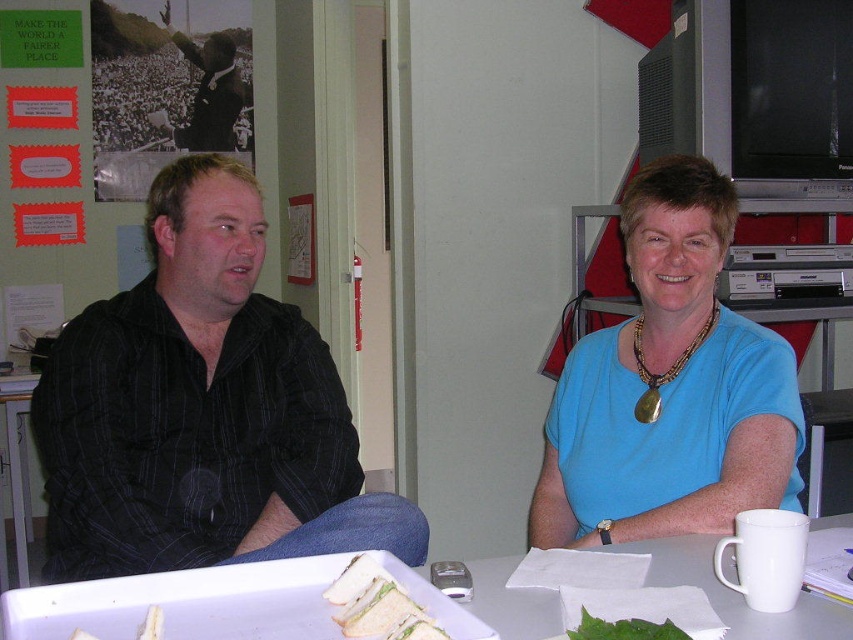
Question: Estimate the real-world distances between objects in this image. Which object is closer to the white bread sandwich at lower center?

Choices:
 (A) green leafy vegetable at lower center
 (B) black suit jacket at upper left
 (C) black striped shirt at left

Answer: (A)

Question: Which object appears farthest from the camera in this image?

Choices:
 (A) black suit jacket at upper left
 (B) blue fabric shirt at center

Answer: (A)

Question: Which object is the farthest from the green leafy vegetable at lower center?

Choices:
 (A) black suit jacket at upper left
 (B) white plastic tray at center

Answer: (A)

Question: Can you confirm if blue fabric shirt at center is positioned to the left of white bread sandwich at lower center?

Choices:
 (A) yes
 (B) no

Answer: (B)

Question: Can you confirm if blue fabric shirt at center is thinner than black suit jacket at upper left?

Choices:
 (A) no
 (B) yes

Answer: (A)

Question: Does white plastic tray at center have a smaller size compared to green leafy vegetable at lower center?

Choices:
 (A) no
 (B) yes

Answer: (A)